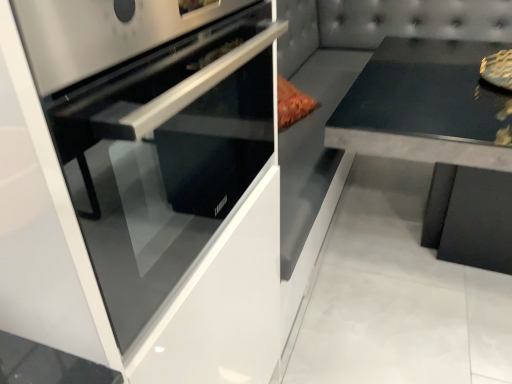
Question: Visually, is satin black oven at left positioned to the left or to the right of black concrete table at right?

Choices:
 (A) right
 (B) left

Answer: (B)

Question: In terms of height, does satin black oven at left look taller or shorter compared to black concrete table at right?

Choices:
 (A) short
 (B) tall

Answer: (A)

Question: Considering the positions of satin black oven at left and black concrete table at right in the image, is satin black oven at left bigger or smaller than black concrete table at right?

Choices:
 (A) big
 (B) small

Answer: (B)

Question: Visually, is black concrete table at right positioned to the left or to the right of satin black oven at left?

Choices:
 (A) left
 (B) right

Answer: (B)

Question: Relative to satin black oven at left, is black concrete table at right in front or behind?

Choices:
 (A) behind
 (B) front

Answer: (A)

Question: Is black concrete table at right inside or outside of satin black oven at left?

Choices:
 (A) outside
 (B) inside

Answer: (A)

Question: Considering the positions of black concrete table at right and satin black oven at left in the image, is black concrete table at right wider or thinner than satin black oven at left?

Choices:
 (A) thin
 (B) wide

Answer: (B)